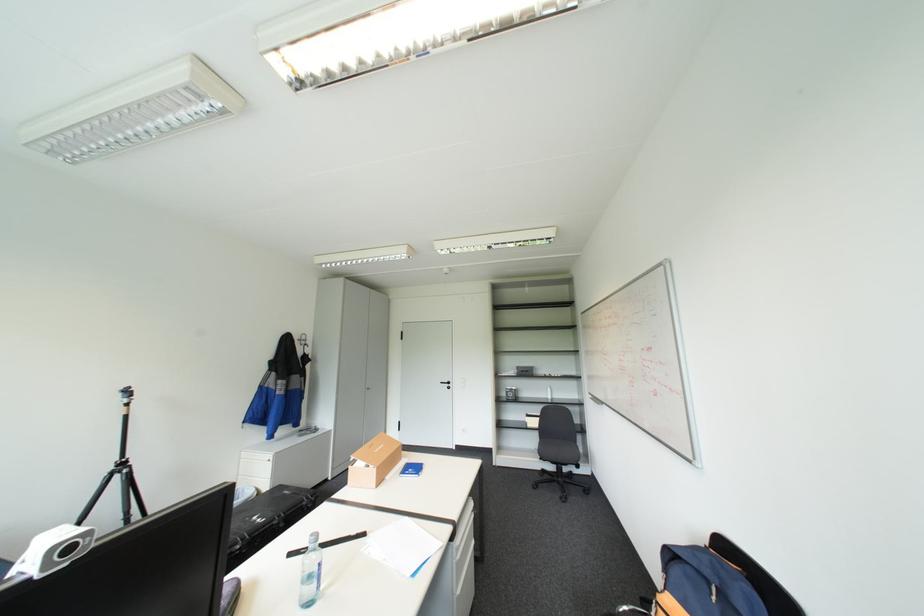
Where would you lift the plastic water bottle? Please return your answer as a coordinate pair (x, y).

(310, 573)